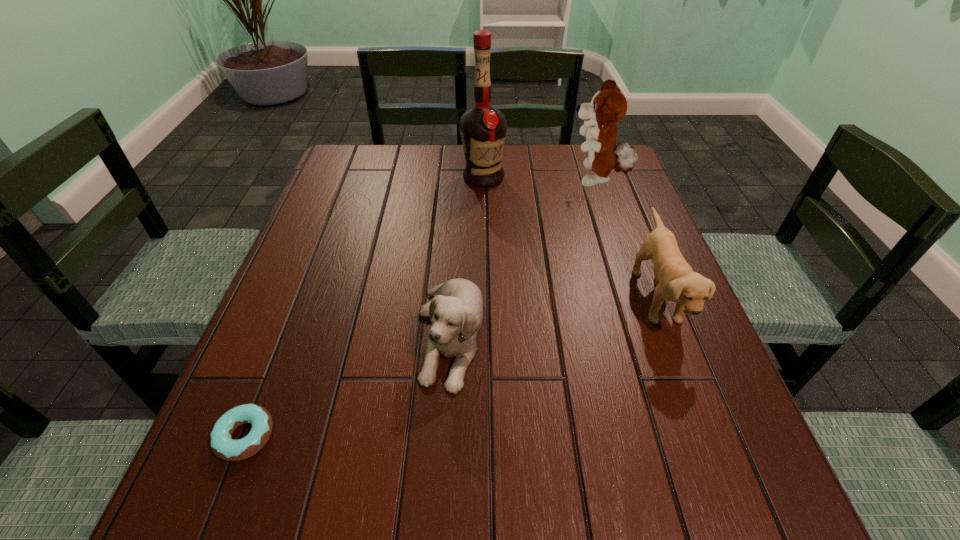
Locate an element on the screen. This screenshot has width=960, height=540. vacant area situated on the front-facing side of the leftmost puppy is located at coordinates (441, 485).

Locate an element on the screen. vacant space located on the right of the shortest object is located at coordinates (304, 436).

Where is `liquor located in the far edge section of the desktop`? The width and height of the screenshot is (960, 540). liquor located in the far edge section of the desktop is located at coordinates (483, 128).

Where is `puppy at the far edge`? The width and height of the screenshot is (960, 540). puppy at the far edge is located at coordinates (608, 106).

The width and height of the screenshot is (960, 540). I want to click on object that is at the left edge, so click(x=223, y=446).

Where is `object located in the far right corner section of the desktop`? Image resolution: width=960 pixels, height=540 pixels. object located in the far right corner section of the desktop is located at coordinates (608, 106).

At what (x,y) coordinates should I click in order to perform the action: click on vacant point at the far edge. Please return your answer as a coordinate pair (x, y). Looking at the image, I should click on (437, 144).

I want to click on vacant space at the near edge of the desktop, so click(x=590, y=485).

The image size is (960, 540). In the image, there is a desktop. Identify the location of vacant region at the left edge. (284, 354).

This screenshot has height=540, width=960. What are the coordinates of `vacant space at the right edge` in the screenshot? It's located at (644, 410).